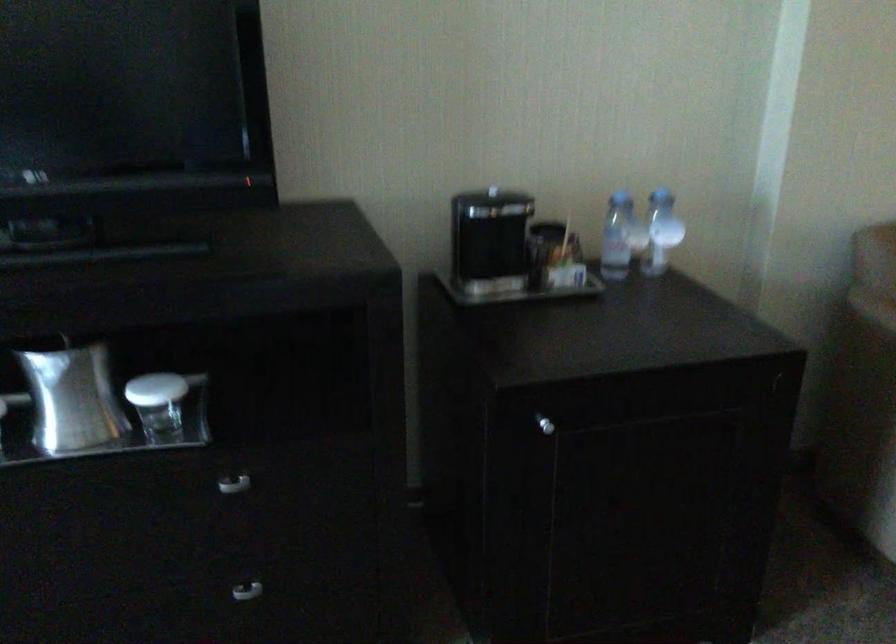
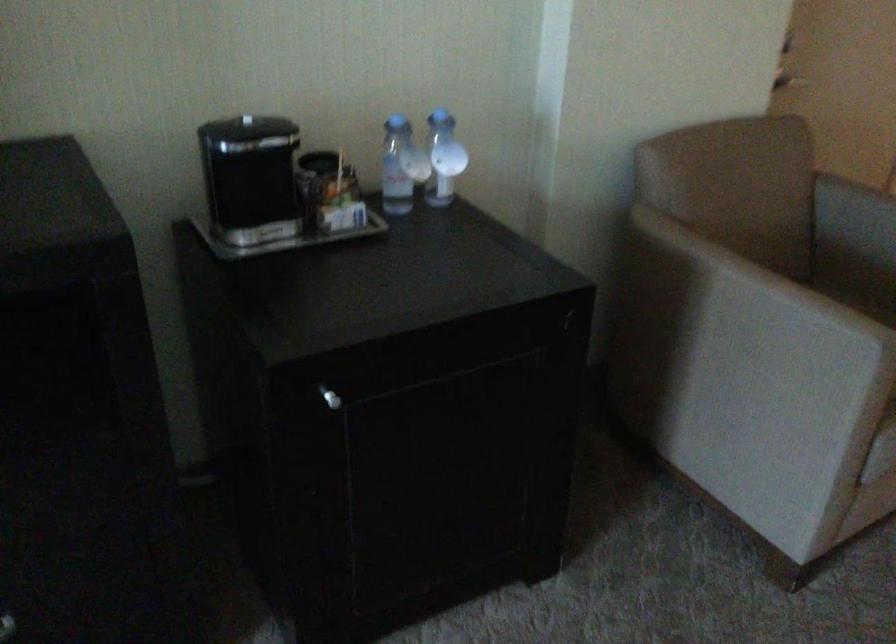
Question: The camera is either moving clockwise (left) or counter-clockwise (right) around the object. The first image is from the beginning of the video and the second image is from the end. Is the camera moving left or right when shooting the video?

Choices:
 (A) Left
 (B) Right

Answer: (A)